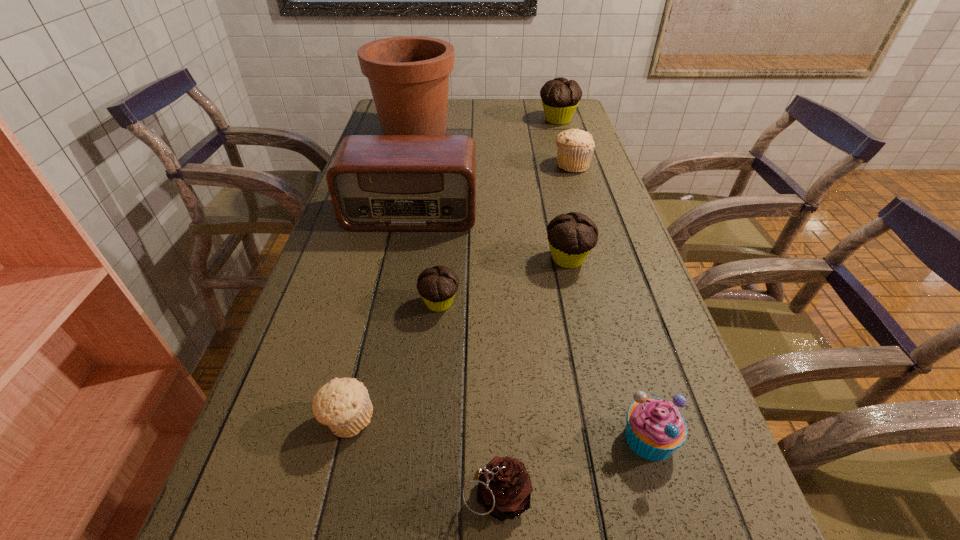
Find the location of a particular element. This screenshot has height=540, width=960. flowerpot is located at coordinates (408, 76).

What are the coordinates of `the fourth farthest object` in the screenshot? It's located at (376, 182).

The width and height of the screenshot is (960, 540). Identify the location of radio receiver. (376, 182).

You are a GUI agent. You are given a task and a screenshot of the screen. Output one action in this format:
    pyautogui.click(x=<x>, y=<y>)
    Task: Click on the tallest muffin
    
    Given the screenshot: What is the action you would take?
    pyautogui.click(x=560, y=97)

The image size is (960, 540). I want to click on the seventh shortest object, so click(x=560, y=97).

Where is `the bigger beige muffin`? the bigger beige muffin is located at coordinates (575, 147).

In order to click on the farther beige muffin in this screenshot , I will do `click(575, 147)`.

This screenshot has width=960, height=540. I want to click on the third farthest muffin, so click(x=571, y=236).

The width and height of the screenshot is (960, 540). In order to click on the second nearest chocolate muffin in this screenshot , I will do `click(571, 236)`.

Find the location of a particular element. This screenshot has width=960, height=540. blue muffin is located at coordinates (655, 428).